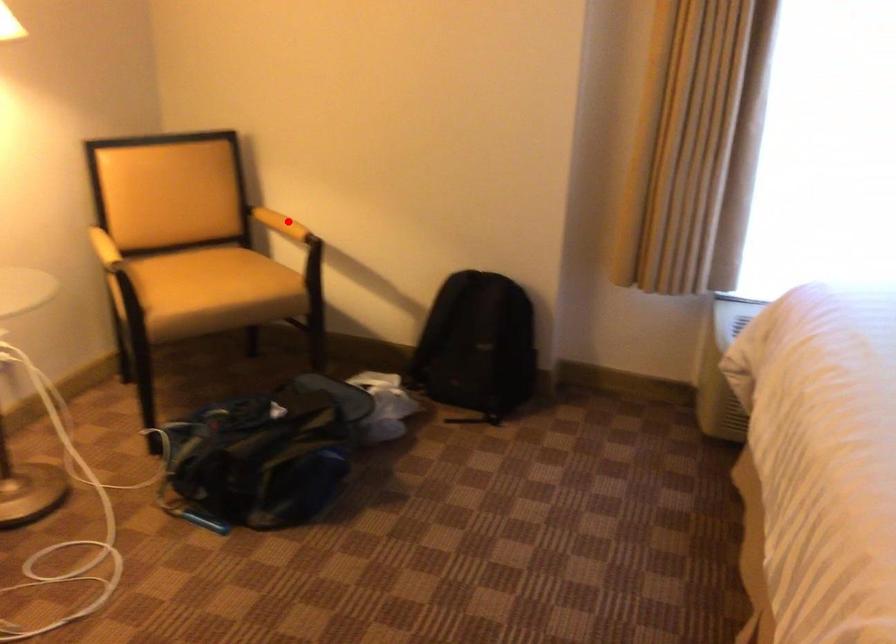
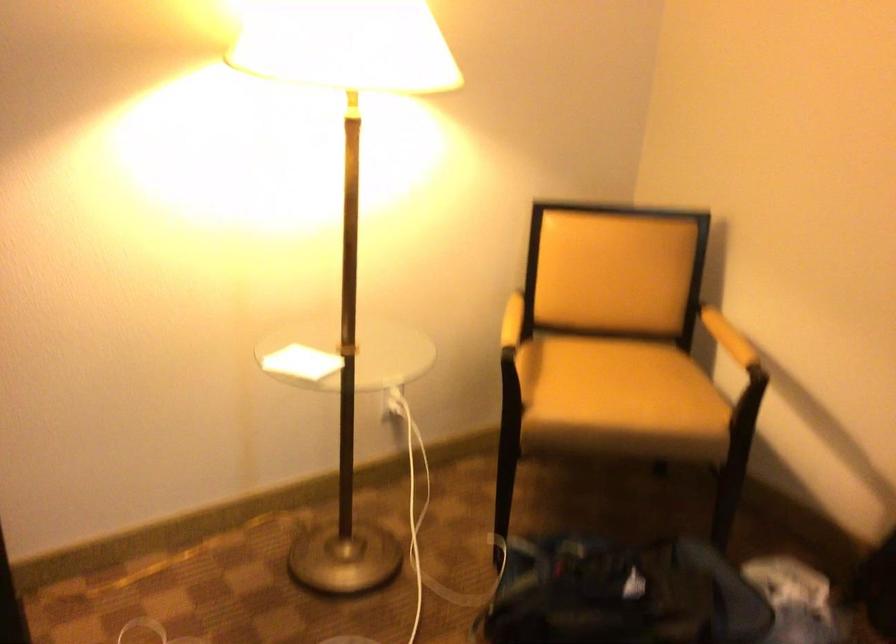
Where in the second image is the point corresponding to the highlighted location from the first image?

(728, 337)